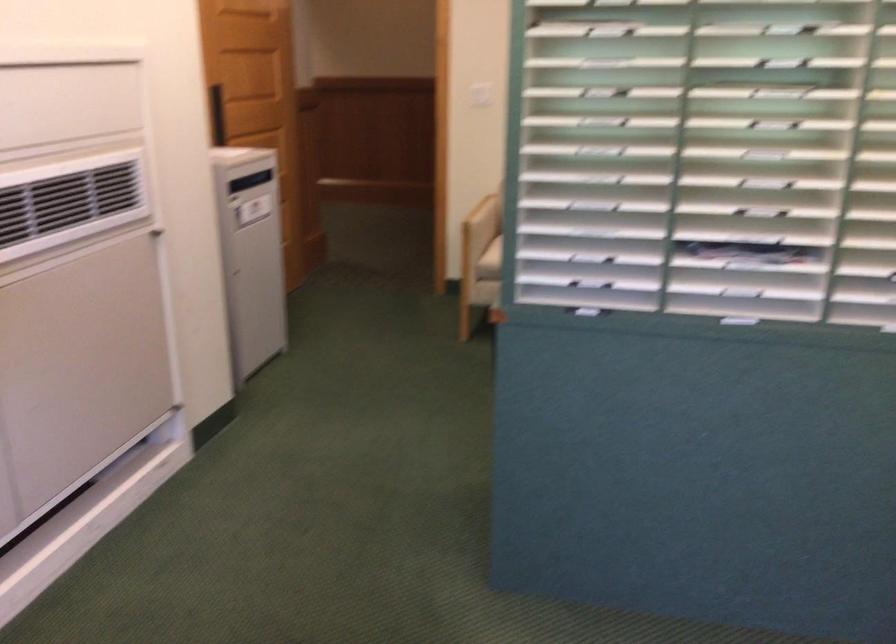
In the scene shown: First-person continuous shooting, in which direction is the camera rotating?

The camera rotated toward right-down.